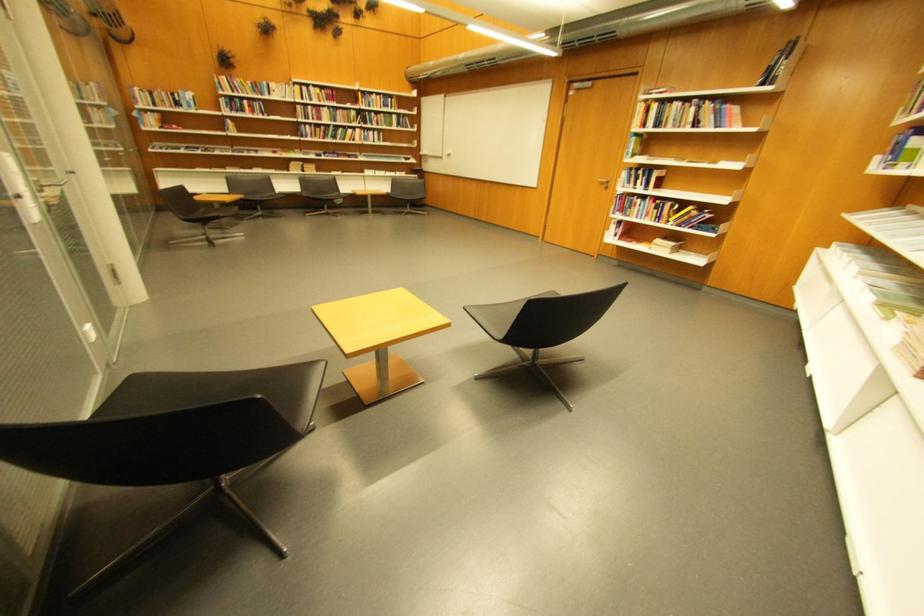
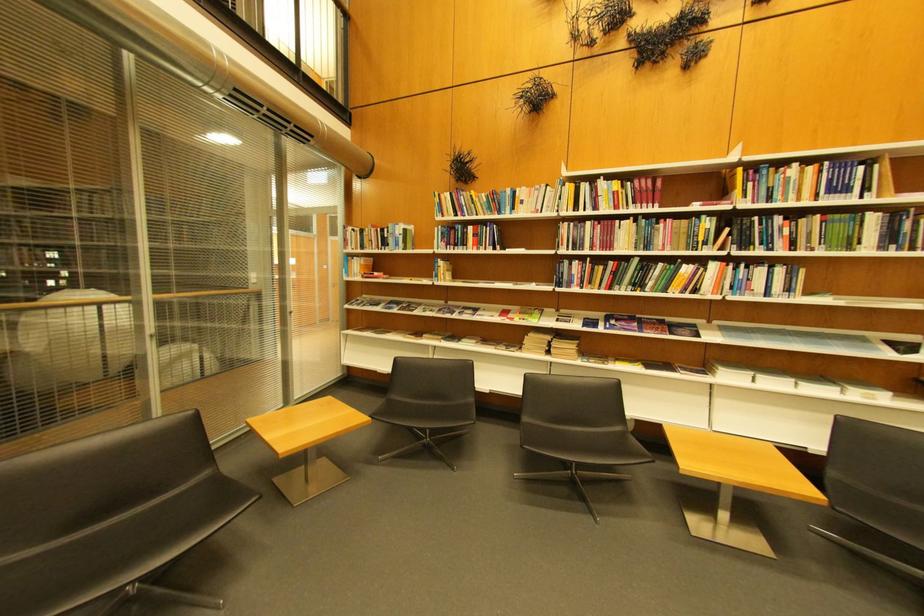
The point at (375, 124) is marked in the first image. Where is the corresponding point in the second image?

(756, 246)